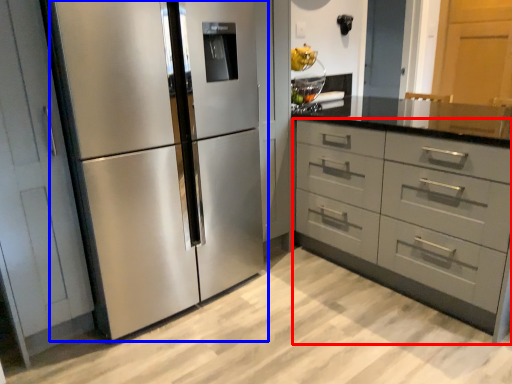
Question: Which object appears farthest to the camera in this image, chest of drawers (highlighted by a red box) or refrigerator (highlighted by a blue box)?

Choices:
 (A) chest of drawers
 (B) refrigerator

Answer: (A)